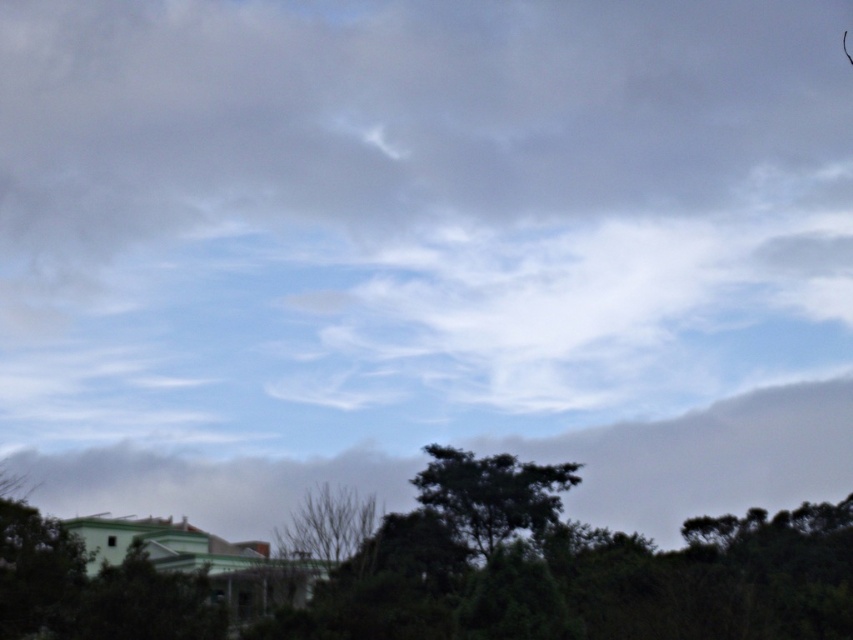
Question: Which is nearer to the dark green leafy tree at center?

Choices:
 (A) green leafy tree at lower center
 (B) white fluffy cloud at center
 (C) white fluffy cloud at upper center

Answer: (A)

Question: Considering the real-world distances, which object is farthest from the dark green leafy tree at center?

Choices:
 (A) bare branches at center
 (B) white fluffy cloud at center
 (C) white fluffy cloud at upper center

Answer: (C)

Question: Is white fluffy cloud at upper center behind bare branches at center?

Choices:
 (A) yes
 (B) no

Answer: (A)

Question: Is white fluffy cloud at upper center thinner than bare branches at center?

Choices:
 (A) no
 (B) yes

Answer: (A)

Question: Can you confirm if white fluffy cloud at upper center is positioned below green leafy tree at lower center?

Choices:
 (A) yes
 (B) no

Answer: (B)

Question: Among these points, which one is nearest to the camera?

Choices:
 (A) (654, 497)
 (B) (538, 496)
 (C) (157, 16)

Answer: (B)